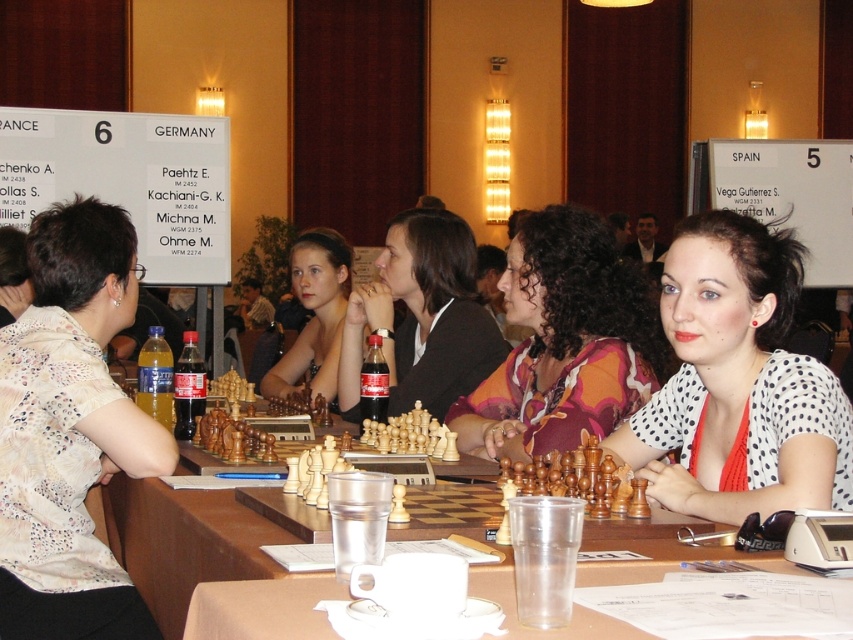
Does white dotted shirt at left appear over matte black jacket at center?

Actually, white dotted shirt at left is below matte black jacket at center.

Which is below, white dotted shirt at left or matte black jacket at center?

white dotted shirt at left is lower down.

You are a GUI agent. You are given a task and a screenshot of the screen. Output one action in this format:
    pyautogui.click(x=<x>, y=<y>)
    Task: Click on the white dotted shirt at left
    
    Given the screenshot: What is the action you would take?
    pyautogui.click(x=70, y=432)

The height and width of the screenshot is (640, 853). Find the location of `white dotted shirt at left`. white dotted shirt at left is located at coordinates pyautogui.click(x=70, y=432).

Can you confirm if printed fabric shirt at center is positioned above wooden chess set at center?

Yes.

Does printed fabric shirt at center come in front of wooden chess set at center?

No.

Between point (648, 364) and point (509, 564), which one is positioned behind?

Point (648, 364)

Locate an element on the screen. The height and width of the screenshot is (640, 853). printed fabric shirt at center is located at coordinates (564, 340).

Image resolution: width=853 pixels, height=640 pixels. What do you see at coordinates (564, 340) in the screenshot? I see `printed fabric shirt at center` at bounding box center [564, 340].

Does printed fabric shirt at center appear on the right side of matte black chess pieces at center?

Yes, printed fabric shirt at center is to the right of matte black chess pieces at center.

Which is in front, point (529, 320) or point (334, 381)?

Point (529, 320) is more forward.

The width and height of the screenshot is (853, 640). I want to click on printed fabric shirt at center, so click(564, 340).